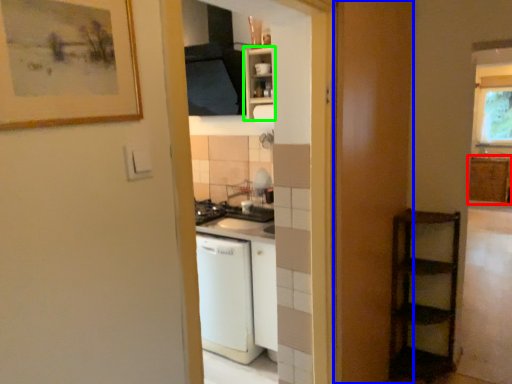
Question: Estimate the real-world distances between objects in this image. Which object is farther from cabinetry (highlighted by a red box), screen door (highlighted by a blue box) or cabinetry (highlighted by a green box)?

Choices:
 (A) screen door
 (B) cabinetry

Answer: (B)